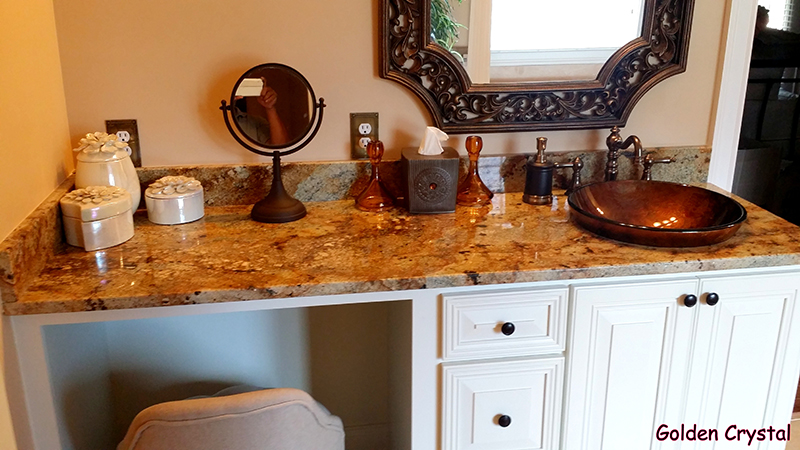
At what (x,y) coordinates should I click in order to perform the action: click on counter top. Please return your answer as a coordinate pair (x, y). Looking at the image, I should click on (426, 256), (294, 243), (510, 222).